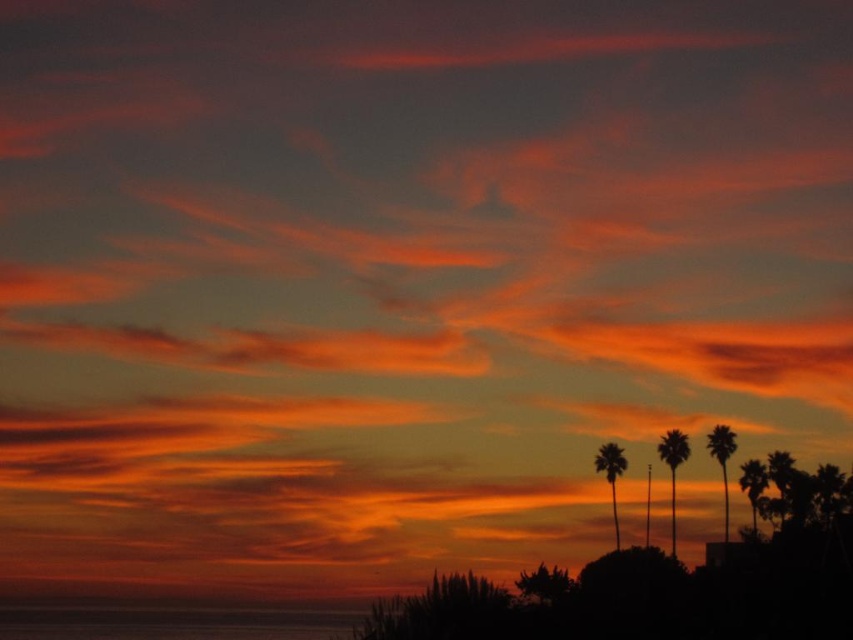
You are standing at the center of the image and want to take a photo of the silhouette palm at right. In which direction should you move to ensure the palm is centered in your camera view?

The silhouette palm at right is located at point 0.790 on the horizontal axis. Since you are at the center, you should move to the right to align the palm in the center of your view.

You are standing on the beach and want to walk towards both the silky brown palm tree at center and the silky brown palm tree at right. Which palm tree will you reach first?

You will reach the silky brown palm tree at center first because it is closer to you than the silky brown palm tree at right, which is further away.